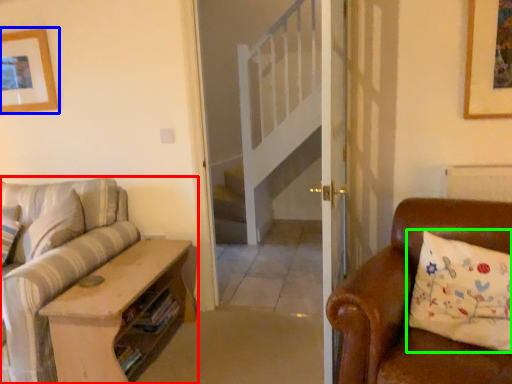
Question: Estimate the real-world distances between objects in this image. Which object is farther from studio couch (highlighted by a red box), picture frame (highlighted by a blue box) or pillow (highlighted by a green box)?

Choices:
 (A) picture frame
 (B) pillow

Answer: (B)